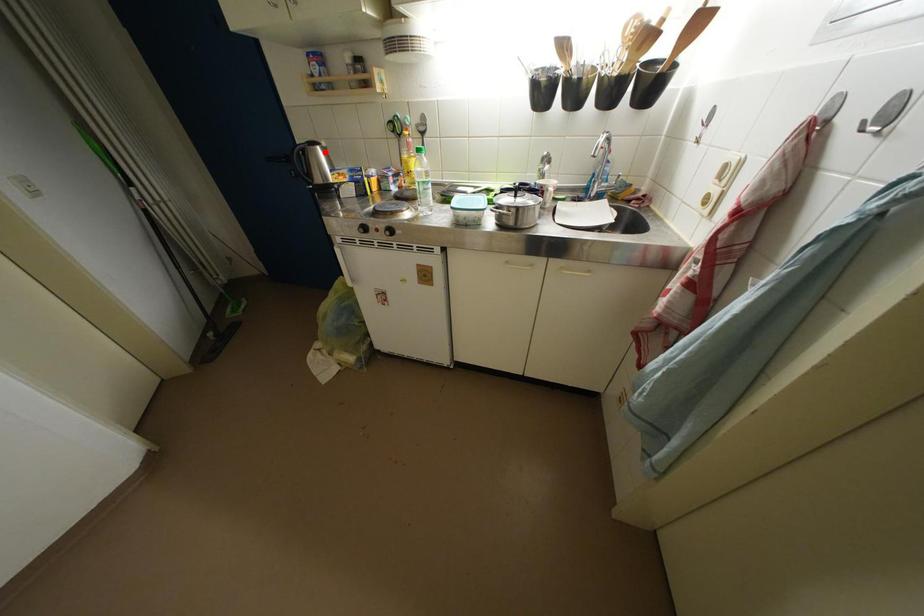
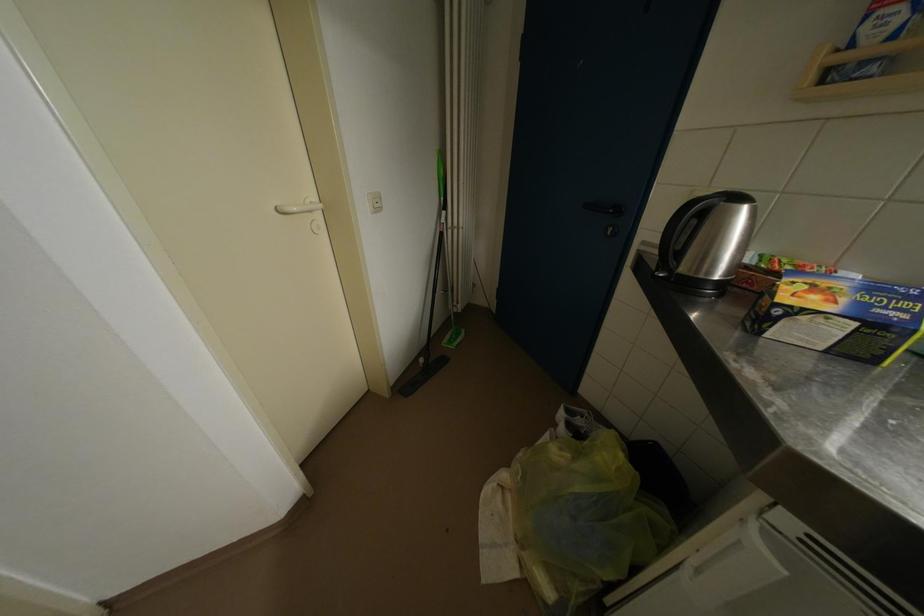
Where in the second image is the point corresponding to the highlighted location from the first image?

(752, 213)